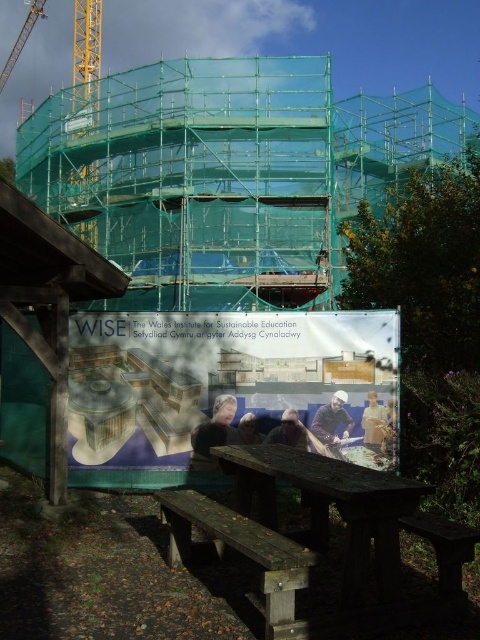
Question: Which point is farther to the camera?

Choices:
 (A) (180, 522)
 (B) (346, 413)
 (C) (448, 524)

Answer: (B)

Question: Can you confirm if smooth skin face at center is positioned to the left of dark blue sweater at center?

Choices:
 (A) no
 (B) yes

Answer: (B)

Question: Can you confirm if smooth skin face at center is bigger than smooth blue shirt at center?

Choices:
 (A) yes
 (B) no

Answer: (A)

Question: Based on their relative distances, which object is nearer to the dark blue sweater at center?

Choices:
 (A) light brown wooden bench at center
 (B) wooden picnic table at lower center
 (C) smooth brown hair at center

Answer: (C)

Question: Which of the following is the farthest from the observer?

Choices:
 (A) (275, 577)
 (B) (334, 397)

Answer: (B)

Question: In this image, where is transparent plastic billboard at center located relative to wooden bench at lower center?

Choices:
 (A) above
 (B) below

Answer: (A)